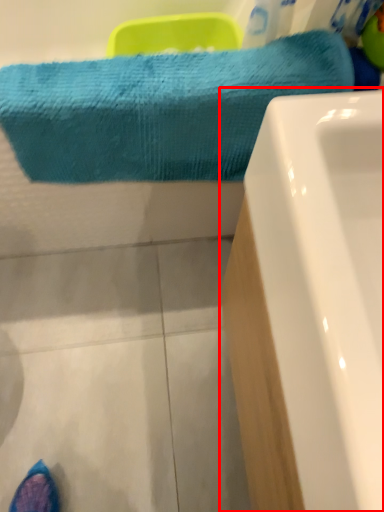
Question: From the image's perspective, where is bathtub (annotated by the red box) located in relation to towel in the image?

Choices:
 (A) above
 (B) below

Answer: (B)